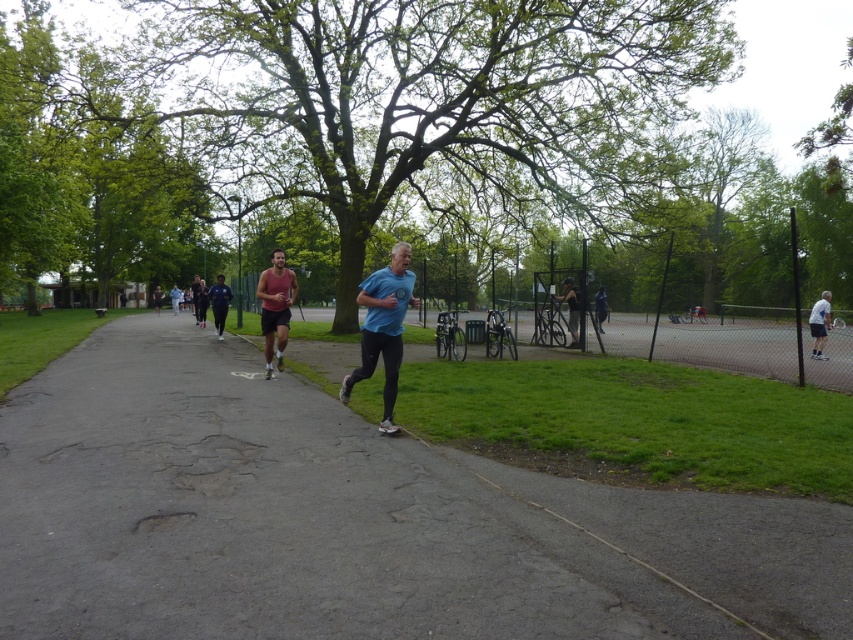
Question: Does gray asphalt path at center come behind green leafy tree at upper left?

Choices:
 (A) no
 (B) yes

Answer: (A)

Question: Where is green leafy tree at center located in relation to blue matte shirt at center in the image?

Choices:
 (A) right
 (B) left

Answer: (B)

Question: Among these points, which one is nearest to the camera?

Choices:
 (A) (216, 324)
 (B) (303, 67)
 (C) (572, 333)
 (D) (483, 484)

Answer: (D)

Question: Is blue matte shirt at center above matte red tank top at center?

Choices:
 (A) no
 (B) yes

Answer: (B)

Question: Which point is farther to the camera?

Choices:
 (A) blue matte shirt at center
 (B) green leafy tree at center
 (C) dark blue jersey at center
 (D) green leafy tree at upper left

Answer: (D)

Question: Which point is closer to the camera?

Choices:
 (A) matte red tank top at center
 (B) green leafy tree at center
 (C) gray asphalt path at center
 (D) white matte tennis racket at right

Answer: (C)